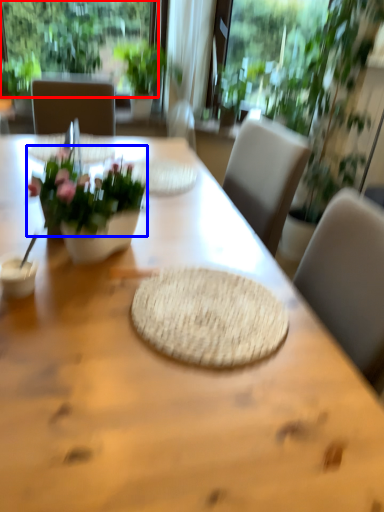
Question: Which point is further to the camera, window (highlighted by a red box) or flower (highlighted by a blue box)?

Choices:
 (A) window
 (B) flower

Answer: (A)